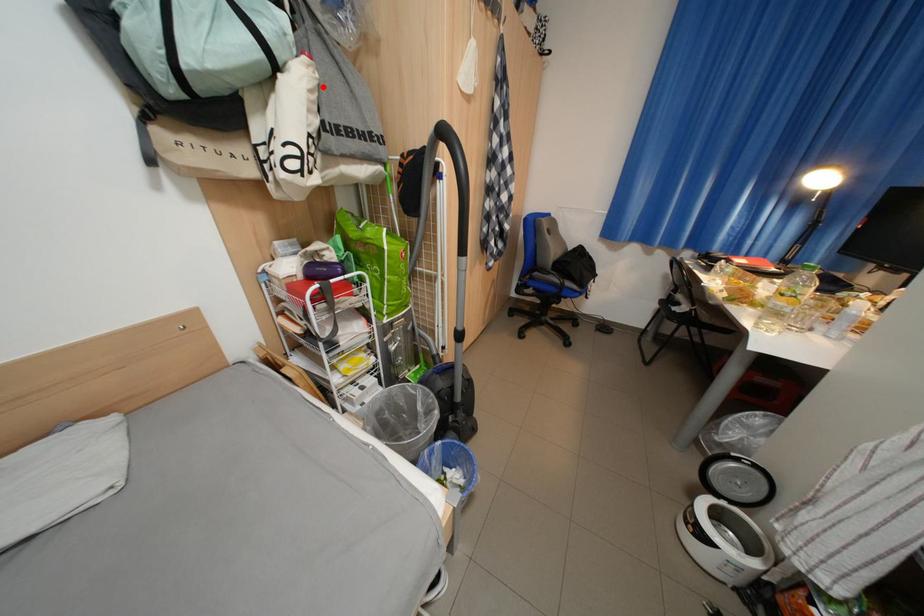
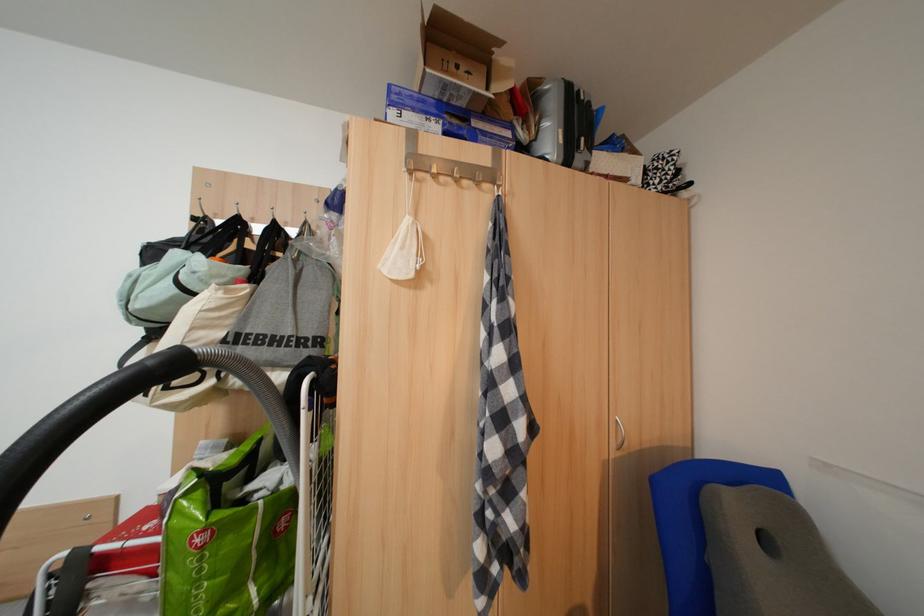
Question: I am providing you with two images of the same scene from different viewpoints. A red point is marked on the first image. Can you still see the location of the red point in image 2?

Choices:
 (A) Yes
 (B) No

Answer: (A)